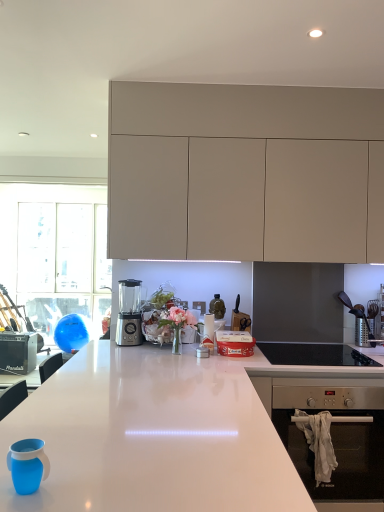
The height and width of the screenshot is (512, 384). Describe the element at coordinates (129, 313) in the screenshot. I see `sleek metallic blender at center` at that location.

Measure the distance between matte beige cabinets at upper center and camera.

matte beige cabinets at upper center is 2.43 meters from camera.

Find the location of a particular element. transparent glass door at left is located at coordinates (61, 261).

Where is `teal silicone cup at lower left`? The image size is (384, 512). teal silicone cup at lower left is located at coordinates (27, 465).

From the image's perspective, would you say teal silicone cup at lower left is positioned over black glass cooktop at lower right?

Yes.

Is black glass cooktop at lower right at the back of teal silicone cup at lower left?

That's not correct — teal silicone cup at lower left is not looking away from black glass cooktop at lower right.

Considering the relative positions of teal silicone cup at lower left and black glass cooktop at lower right in the image provided, is teal silicone cup at lower left behind black glass cooktop at lower right?

No, the depth of teal silicone cup at lower left is less than that of black glass cooktop at lower right.

Is point (33, 449) in front of point (341, 354)?

That is True.

Which object is closer to the camera taking this photo, matte beige cabinets at upper center or teal silicone cup at lower left?

Positioned in front is teal silicone cup at lower left.

Does matte beige cabinets at upper center have a lesser width compared to teal silicone cup at lower left?

Incorrect, the width of matte beige cabinets at upper center is not less than that of teal silicone cup at lower left.

From the image's perspective, between matte beige cabinets at upper center and teal silicone cup at lower left, which one is located above?

matte beige cabinets at upper center.

Who is shorter, matte beige cabinets at upper center or teal silicone cup at lower left?

With less height is teal silicone cup at lower left.

What's the angular difference between black glass cooktop at lower right and sleek metallic blender at center's facing directions?

The facing directions of black glass cooktop at lower right and sleek metallic blender at center are 12.3 degrees apart.

From the image's perspective, is black glass cooktop at lower right above or below sleek metallic blender at center?

Based on their image positions, black glass cooktop at lower right is located beneath sleek metallic blender at center.

Could you tell me if black glass cooktop at lower right is facing sleek metallic blender at center?

No, black glass cooktop at lower right does not turn towards sleek metallic blender at center.

Are black glass cooktop at lower right and sleek metallic blender at center far apart?

Actually, black glass cooktop at lower right and sleek metallic blender at center are a little close together.

Considering the sizes of objects teal silicone cup at lower left and white glossy countertop at center in the image provided, who is wider, teal silicone cup at lower left or white glossy countertop at center?

white glossy countertop at center is wider.

Who is smaller, teal silicone cup at lower left or white glossy countertop at center?

teal silicone cup at lower left.

From a real-world perspective, is teal silicone cup at lower left beneath white glossy countertop at center?

No, from a real-world perspective, teal silicone cup at lower left is not under white glossy countertop at center.

Considering the positions of points (19, 489) and (128, 399), is point (19, 489) farther from camera compared to point (128, 399)?

That is False.

Which of these two, sleek metallic blender at center or black glass cooktop at lower right, is smaller?

sleek metallic blender at center is smaller.

From a real-world perspective, is sleek metallic blender at center positioned above or below black glass cooktop at lower right?

From a real-world perspective, sleek metallic blender at center is physically above black glass cooktop at lower right.

Can you confirm if sleek metallic blender at center is positioned to the right of black glass cooktop at lower right?

No.

Which of these two, black glass cooktop at lower right or matte beige cabinets at upper center, is smaller?

With smaller size is black glass cooktop at lower right.

Considering the positions of points (332, 353) and (361, 134), is point (332, 353) closer to camera compared to point (361, 134)?

That is False.

Considering the positions of objects black glass cooktop at lower right and matte beige cabinets at upper center in the image provided, who is in front, black glass cooktop at lower right or matte beige cabinets at upper center?

black glass cooktop at lower right is in front.

Where is `cabinetry lying behind the black glass cooktop at lower right`? The height and width of the screenshot is (512, 384). cabinetry lying behind the black glass cooktop at lower right is located at coordinates (245, 170).

Considering the sizes of black glass cooktop at lower right and white glossy countertop at center in the image, is black glass cooktop at lower right wider or thinner than white glossy countertop at center?

Clearly, black glass cooktop at lower right has less width compared to white glossy countertop at center.

Is black glass cooktop at lower right not inside white glossy countertop at center?

black glass cooktop at lower right lies outside white glossy countertop at center's area.

Which is more to the left, black glass cooktop at lower right or white glossy countertop at center?

white glossy countertop at center.

Which of these two, black glass cooktop at lower right or white glossy countertop at center, is bigger?

With larger size is white glossy countertop at center.

The height and width of the screenshot is (512, 384). I want to click on teal above the black glass cooktop at lower right (from the image's perspective), so click(x=27, y=465).

Locate an element on the screen. This screenshot has width=384, height=512. teal below the matte beige cabinets at upper center (from the image's perspective) is located at coordinates (27, 465).

Estimate the real-world distances between objects in this image. Which object is closer to transparent glass door at left, teal silicone cup at lower left or white glossy countertop at center?

The object closer to transparent glass door at left is white glossy countertop at center.

Considering their positions, is black glass cooktop at lower right positioned further to matte beige cabinets at upper center than white glossy countertop at center?

white glossy countertop at center.

From the image, which object appears to be farther from black glass cooktop at lower right, transparent glass door at left or white glossy countertop at center?

transparent glass door at left is positioned further to the anchor black glass cooktop at lower right.

From the picture: Based on their spatial positions, is black glass cooktop at lower right or matte beige cabinets at upper center further from teal silicone cup at lower left?

Based on the image, matte beige cabinets at upper center appears to be further to teal silicone cup at lower left.

Based on their spatial positions, is teal silicone cup at lower left or sleek metallic blender at center further from black glass cooktop at lower right?

teal silicone cup at lower left is further to black glass cooktop at lower right.

Considering their positions, is matte beige cabinets at upper center positioned closer to transparent glass door at left than sleek metallic blender at center?

Among the two, sleek metallic blender at center is located nearer to transparent glass door at left.

Based on their spatial positions, is sleek metallic blender at center or teal silicone cup at lower left closer to matte beige cabinets at upper center?

sleek metallic blender at center is closer to matte beige cabinets at upper center.

From the image, which object appears to be nearer to teal silicone cup at lower left, transparent glass door at left or sleek metallic blender at center?

sleek metallic blender at center is closer to teal silicone cup at lower left.

At what (x,y) coordinates should I click in order to perform the action: click on kitchen appliance between black glass cooktop at lower right and transparent glass door at left from front to back. Please return your answer as a coordinate pair (x, y). The width and height of the screenshot is (384, 512). Looking at the image, I should click on (129, 313).

The image size is (384, 512). Identify the location of gas stove positioned between teal silicone cup at lower left and sleek metallic blender at center from near to far. (314, 354).

Identify the location of cabinetry positioned between white glossy countertop at center and sleek metallic blender at center from near to far. (245, 170).

Identify the location of gas stove between teal silicone cup at lower left and transparent glass door at left along the z-axis. Image resolution: width=384 pixels, height=512 pixels. (314, 354).